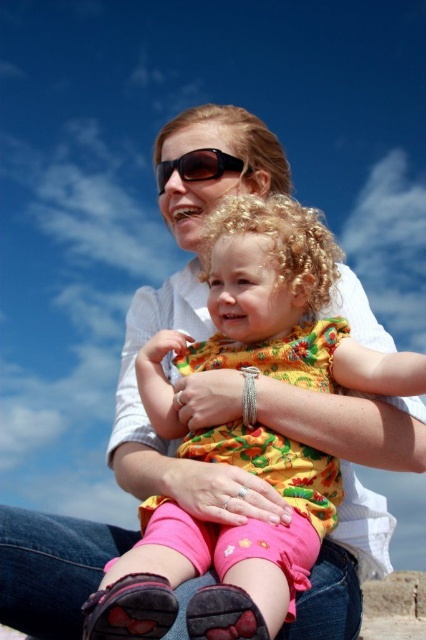
Looking at the scene, where is the floral cotton dress at center in relation to the black plastic sunglasses at center?

The floral cotton dress at center is to the right of the black plastic sunglasses at center.

You are a photographer trying to capture a closeup of the floral cotton dress at center without the black plastic sunglasses at center blocking the view. Based on their positions, do you think you can achieve this?

The floral cotton dress at center is in front of the black plastic sunglasses at center, so it is already blocking the view of the sunglasses. To capture a clear closeup of the dress without the sunglasses blocking, you would need to adjust the angle or position to ensure the dress is not obscuring the sunglasses, but since the dress is in front, it might be challenging unless moving the dress or sunglasses.